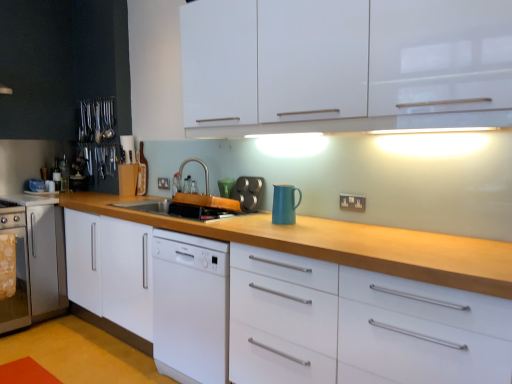
Question: From a real-world perspective, is metallic silver muffin tin at center, the 1th appliance viewed from the right, over black plastic electric outlet at center, positioned as the first electric outlet in top-to-bottom order?

Choices:
 (A) no
 (B) yes

Answer: (A)

Question: From the image's perspective, is metallic silver muffin tin at center, which ranks as the first appliance in top-to-bottom order, under black plastic electric outlet at center, positioned as the first electric outlet in top-to-bottom order?

Choices:
 (A) yes
 (B) no

Answer: (A)

Question: Considering the relative positions of metallic silver muffin tin at center, which is the first appliance in front-to-back order, and black plastic electric outlet at center, the second electric outlet positioned from the right, in the image provided, is metallic silver muffin tin at center, which is the first appliance in front-to-back order, to the left of black plastic electric outlet at center, the second electric outlet positioned from the right, from the viewer's perspective?

Choices:
 (A) no
 (B) yes

Answer: (A)

Question: Is metallic silver muffin tin at center, acting as the second appliance starting from the left, turned away from black plastic electric outlet at center, which ranks as the first electric outlet in left-to-right order?

Choices:
 (A) no
 (B) yes

Answer: (A)

Question: From the image's perspective, does metallic silver muffin tin at center, which appears as the second appliance when viewed from the back, appear higher than black plastic electric outlet at center, which is the 2th electric outlet from bottom to top?

Choices:
 (A) no
 (B) yes

Answer: (A)

Question: Is metallic silver muffin tin at center, the 2th appliance positioned from the bottom, positioned far away from black plastic electric outlet at center, which is the 2th electric outlet from bottom to top?

Choices:
 (A) yes
 (B) no

Answer: (B)

Question: Considering the relative sizes of white glossy cabinet at upper center and metallic silver muffin tin at center, which ranks as the first appliance in top-to-bottom order, in the image provided, is white glossy cabinet at upper center taller than metallic silver muffin tin at center, which ranks as the first appliance in top-to-bottom order,?

Choices:
 (A) yes
 (B) no

Answer: (A)

Question: Does white glossy cabinet at upper center touch metallic silver muffin tin at center, which ranks as the first appliance in top-to-bottom order?

Choices:
 (A) no
 (B) yes

Answer: (A)

Question: Does white glossy cabinet at upper center contain metallic silver muffin tin at center, which is the first appliance in front-to-back order?

Choices:
 (A) no
 (B) yes

Answer: (A)

Question: Is white glossy cabinet at upper center aimed at metallic silver muffin tin at center, which appears as the second appliance when viewed from the back?

Choices:
 (A) no
 (B) yes

Answer: (A)

Question: Considering the relative sizes of white glossy cabinet at upper center and metallic silver muffin tin at center, which ranks as the first appliance in top-to-bottom order, in the image provided, is white glossy cabinet at upper center thinner than metallic silver muffin tin at center, which ranks as the first appliance in top-to-bottom order,?

Choices:
 (A) no
 (B) yes

Answer: (A)

Question: From a real-world perspective, is white glossy cabinet at upper center beneath metallic silver muffin tin at center, acting as the second appliance starting from the left?

Choices:
 (A) yes
 (B) no

Answer: (B)

Question: Is black plastic electric outlet at center, positioned as the first electric outlet in back-to-front order, not within stainless steel oven at left, arranged as the 2th appliance when viewed from the front?

Choices:
 (A) no
 (B) yes

Answer: (B)